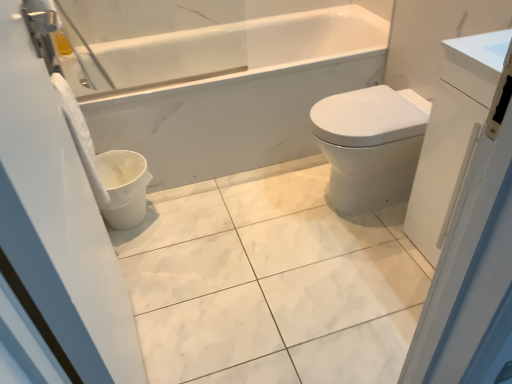
The height and width of the screenshot is (384, 512). Identify the location of free space to the left of white glossy bidet at right. (267, 206).